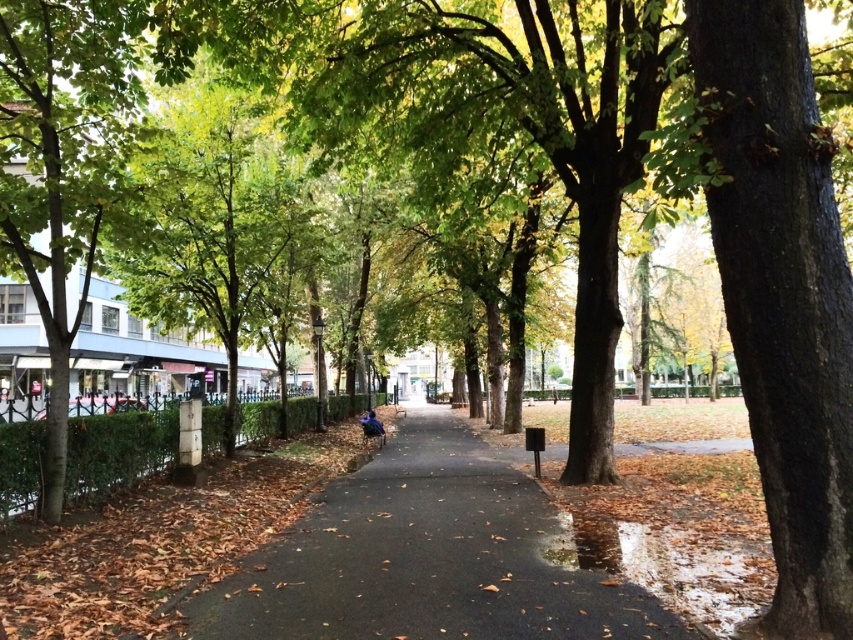
You are a pedestrian standing on the pathway in the park and want to reach the blue fabric at center. Which direction should you walk to avoid the brown rough bark tree at right?

The brown rough bark tree at right is to the right of the blue fabric at center, so you should walk to the left to reach the blue fabric at center while avoiding the tree.